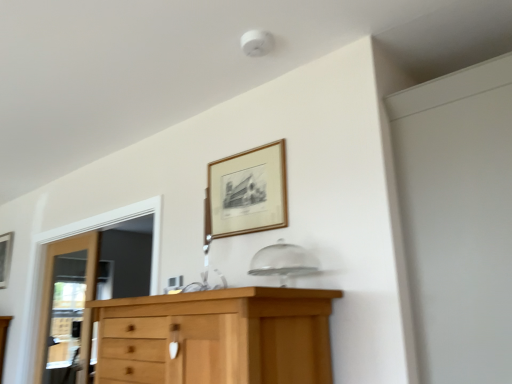
Question: From the image's perspective, does wooden picture frame at upper center, acting as the 2th picture frame starting from the back, appear higher than white matte screen door at upper right?

Choices:
 (A) no
 (B) yes

Answer: (B)

Question: Is wooden picture frame at upper center, acting as the 2th picture frame starting from the bottom, looking in the opposite direction of white matte screen door at upper right?

Choices:
 (A) yes
 (B) no

Answer: (B)

Question: Can you confirm if wooden picture frame at upper center, the 1th picture frame positioned from the right, is taller than white matte screen door at upper right?

Choices:
 (A) yes
 (B) no

Answer: (B)

Question: Considering the relative sizes of wooden picture frame at upper center, acting as the 2th picture frame starting from the back, and white matte screen door at upper right in the image provided, is wooden picture frame at upper center, acting as the 2th picture frame starting from the back, thinner than white matte screen door at upper right?

Choices:
 (A) no
 (B) yes

Answer: (B)

Question: Does wooden picture frame at upper center, the 1th picture frame positioned from the right, have a larger size compared to white matte screen door at upper right?

Choices:
 (A) no
 (B) yes

Answer: (A)

Question: Looking at the image, does white matte screen door at upper right seem bigger or smaller compared to wooden picture frame at left, placed as the second picture frame when sorted from right to left?

Choices:
 (A) big
 (B) small

Answer: (A)

Question: Considering the positions of white matte screen door at upper right and wooden picture frame at left, which appears as the 1th picture frame when viewed from the left, in the image, is white matte screen door at upper right wider or thinner than wooden picture frame at left, which appears as the 1th picture frame when viewed from the left,?

Choices:
 (A) thin
 (B) wide

Answer: (B)

Question: Is point (457, 76) closer or farther from the camera than point (1, 276)?

Choices:
 (A) closer
 (B) farther

Answer: (A)

Question: Considering the positions of white matte screen door at upper right and wooden picture frame at left, which is the first picture frame in bottom-to-top order, in the image, is white matte screen door at upper right taller or shorter than wooden picture frame at left, which is the first picture frame in bottom-to-top order,?

Choices:
 (A) tall
 (B) short

Answer: (A)

Question: In the image, is wooden picture frame at left, positioned as the 2th picture frame in top-to-bottom order, positioned in front of or behind wooden picture frame at upper center, acting as the 2th picture frame starting from the left?

Choices:
 (A) behind
 (B) front

Answer: (A)

Question: Would you say wooden picture frame at left, placed as the second picture frame when sorted from right to left, is inside or outside wooden picture frame at upper center, the 1th picture frame from the top?

Choices:
 (A) outside
 (B) inside

Answer: (A)

Question: From the image's perspective, relative to wooden picture frame at upper center, the 1th picture frame positioned from the right, is wooden picture frame at left, which appears as the second picture frame when viewed from the front, above or below?

Choices:
 (A) below
 (B) above

Answer: (A)

Question: From their relative heights in the image, would you say wooden picture frame at left, which ranks as the first picture frame in back-to-front order, is taller or shorter than wooden picture frame at upper center, acting as the 2th picture frame starting from the back?

Choices:
 (A) tall
 (B) short

Answer: (A)

Question: From a real-world perspective, is wooden picture frame at left, positioned as the 2th picture frame in top-to-bottom order, physically located above or below wooden door at left?

Choices:
 (A) above
 (B) below

Answer: (A)

Question: Is point coord(1,256) positioned closer to the camera than point coord(87,276)?

Choices:
 (A) closer
 (B) farther

Answer: (B)